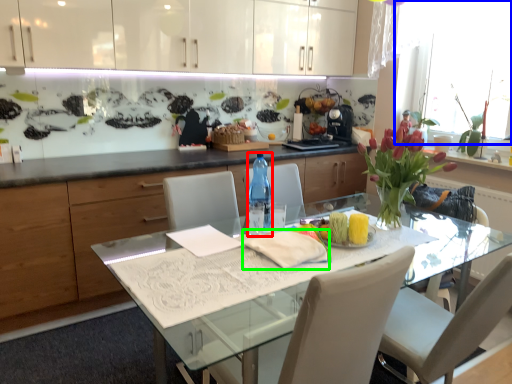
Question: Which object is positioned closest to bottle (highlighted by a red box)? Select from window screen (highlighted by a blue box) and cloth (highlighted by a green box).

Choices:
 (A) window screen
 (B) cloth

Answer: (B)